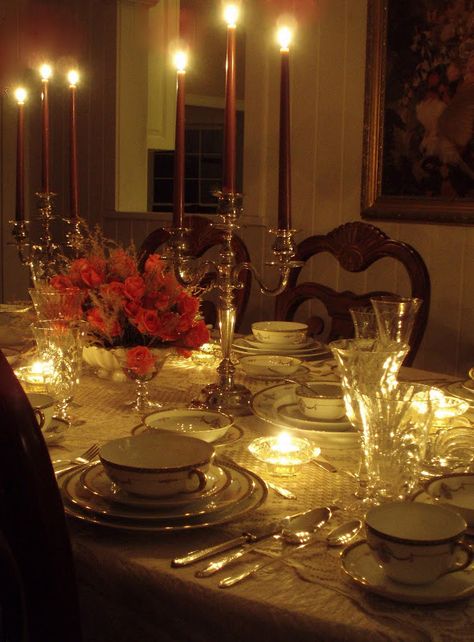
You are a GUI agent. You are given a task and a screenshot of the screen. Output one action in this format:
    pyautogui.click(x=<x>, y=<y>)
    Task: Click on the bowls
    Image resolution: width=474 pixels, height=642 pixels.
    Given the screenshot: What is the action you would take?
    pyautogui.click(x=164, y=467), pyautogui.click(x=283, y=333), pyautogui.click(x=328, y=404), pyautogui.click(x=457, y=496)